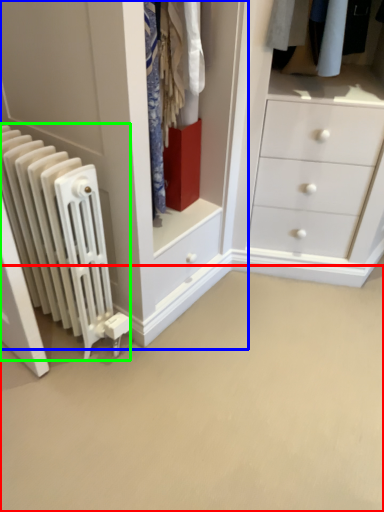
Question: Which object is the closest to the plain (highlighted by a red box)? Choose among these: closet (highlighted by a blue box) or radiator (highlighted by a green box).

Choices:
 (A) closet
 (B) radiator

Answer: (B)